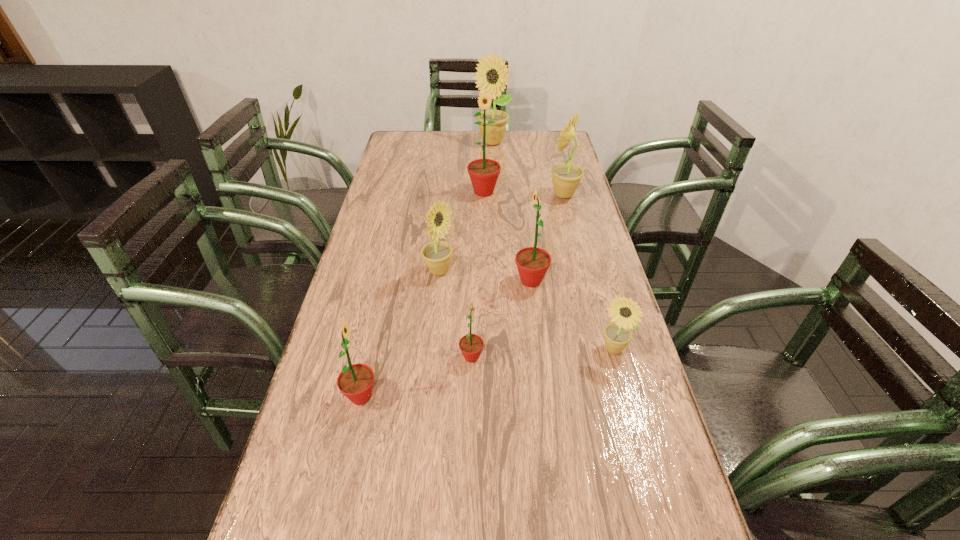
This screenshot has width=960, height=540. I want to click on empty space between the farthest green sunflower and the leftmost object, so click(422, 294).

Locate which object ranks sixth in proximity to the third biggest green sunflower. Please provide its 2D coordinates. Your answer should be formatted as a tuple, i.e. [(x, y)], where the tuple contains the x and y coordinates of a point satisfying the conditions above.

[(566, 177)]

Point out which object is positioned as the sixth nearest to the leftmost green sunflower. Please provide its 2D coordinates. Your answer should be formatted as a tuple, i.e. [(x, y)], where the tuple contains the x and y coordinates of a point satisfying the conditions above.

[(566, 177)]

At what (x,y) coordinates should I click in order to perform the action: click on the closest sunflower to the seventh object from right to left. Please return your answer as a coordinate pair (x, y). Looking at the image, I should click on (532, 262).

Identify the location of sunflower that stands as the sixth closest to the leftmost yellow sunflower. This screenshot has height=540, width=960. (566, 177).

This screenshot has width=960, height=540. I want to click on the third closest yellow sunflower to the second farthest yellow sunflower, so click(x=626, y=313).

In order to click on yellow sunflower that is the second nearest to the farthest green sunflower in this screenshot , I will do pos(491,70).

Locate an element on the screen. green sunflower that is the closest to the nearest yellow sunflower is located at coordinates (532, 262).

Point out which green sunflower is positioned as the second nearest to the third farthest green sunflower. Please provide its 2D coordinates. Your answer should be formatted as a tuple, i.e. [(x, y)], where the tuple contains the x and y coordinates of a point satisfying the conditions above.

[(532, 262)]

Where is `free location that satisfies the following two spatial constraints: 1. on the face of the nearest yellow sunflower; 2. on the face of the nearest green sunflower`? The width and height of the screenshot is (960, 540). free location that satisfies the following two spatial constraints: 1. on the face of the nearest yellow sunflower; 2. on the face of the nearest green sunflower is located at coordinates (626, 396).